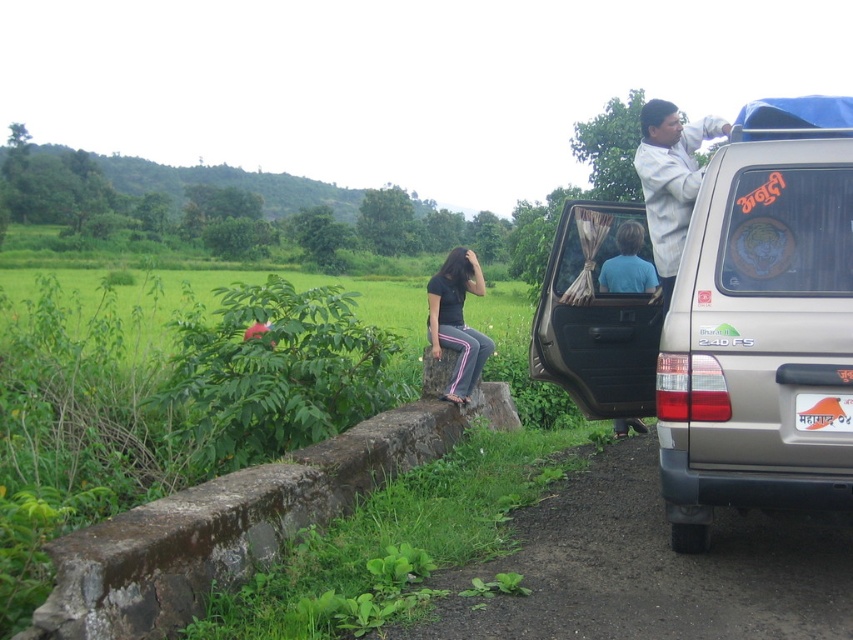
You are standing at the point with coordinates point (x=648, y=202) and want to walk to the point with coordinates point (x=622, y=387). Is the point you want to reach in front of or behind you?

The point (x=622, y=387) is behind point (x=648, y=202), so the point you want to reach is behind you.

You are a photographer trying to capture a photo of the silver metallic jeep at right and the matte black shirt at center. Since you want to emphasize both objects equally in the frame, which one should you zoom in on more?

The silver metallic jeep at right is smaller in size compared to the matte black shirt at center, so you should zoom in more on the silver metallic jeep at right to balance their sizes in the photo.

You are standing at the point labeled point (693, 518) and want to walk to the point labeled point (431, 291). According to the scene, which direction should you face to walk directly towards your destination?

Since point (693, 518) is in front of point (431, 291), you should face backwards to walk directly towards point (431, 291).